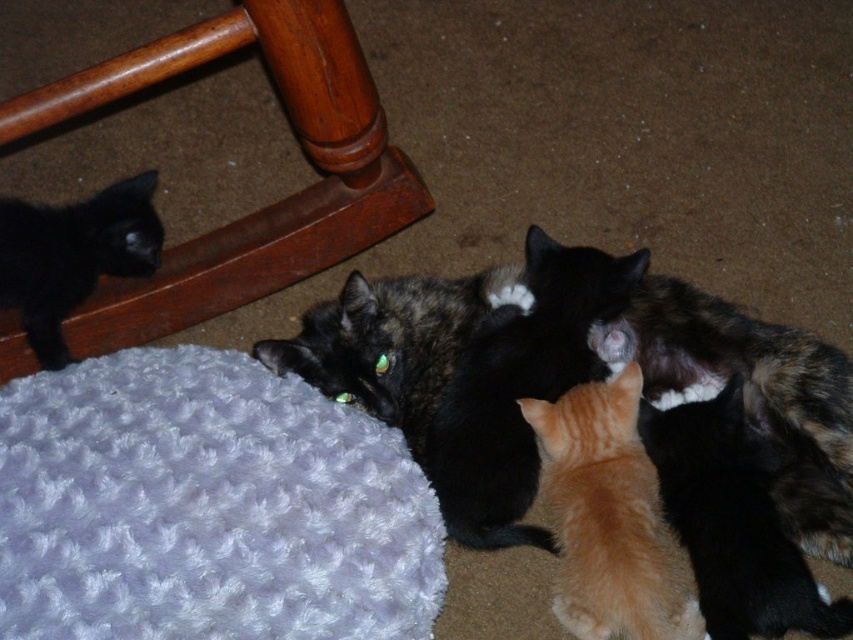
Question: Is fluffy orange kitten at center to the right of orange fur cat at center from the viewer's perspective?

Choices:
 (A) no
 (B) yes

Answer: (A)

Question: Does orange fur cat at center have a lesser width compared to fluffy tortoiseshell cat at center?

Choices:
 (A) no
 (B) yes

Answer: (B)

Question: Which object is closer to the camera taking this photo?

Choices:
 (A) orange fur cat at center
 (B) fluffy tortoiseshell cat at center
 (C) wooden rocking chair at lower left
 (D) fluffy orange kitten at center

Answer: (A)

Question: Which is farther from the black fur cat at left?

Choices:
 (A) orange fur cat at center
 (B) black fur cat at center
 (C) fluffy tortoiseshell cat at center
 (D) wooden rocking chair at lower left

Answer: (C)

Question: Does orange fur cat at center have a smaller size compared to black fur cat at left?

Choices:
 (A) yes
 (B) no

Answer: (B)

Question: Based on their relative distances, which object is nearer to the black fur cat at center?

Choices:
 (A) orange fur cat at center
 (B) wooden rocking chair at lower left
 (C) fluffy orange kitten at center
 (D) fluffy tortoiseshell cat at center

Answer: (C)